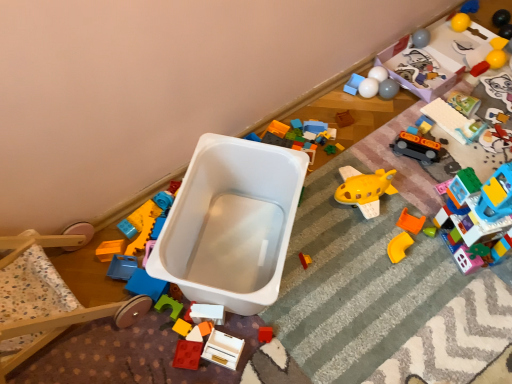
This screenshot has width=512, height=384. Identify the location of vacant space that is in between orange plastic train at center, the eleventh toy positioned from the left, and wooden toy box at center, the thirteenth toy positioned from the right. (335, 240).